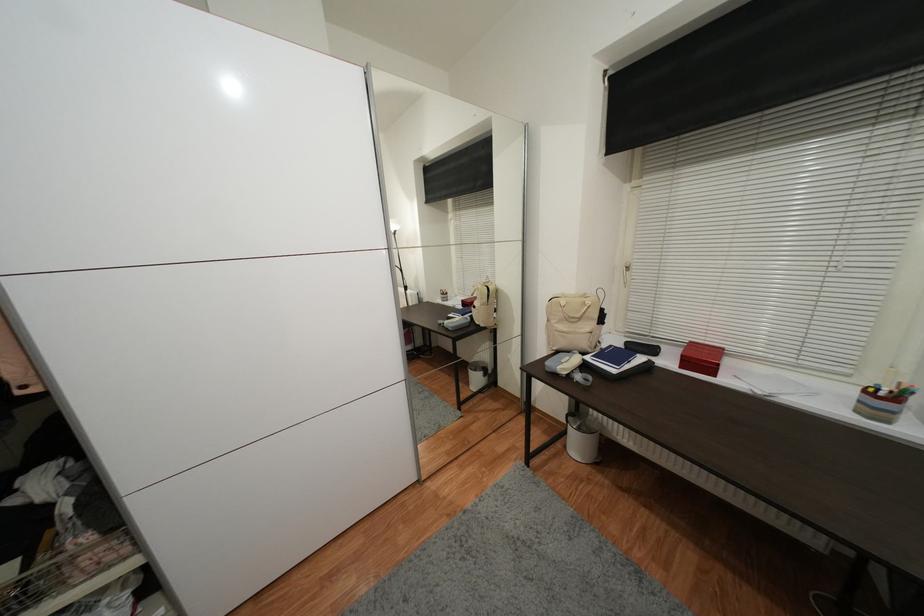
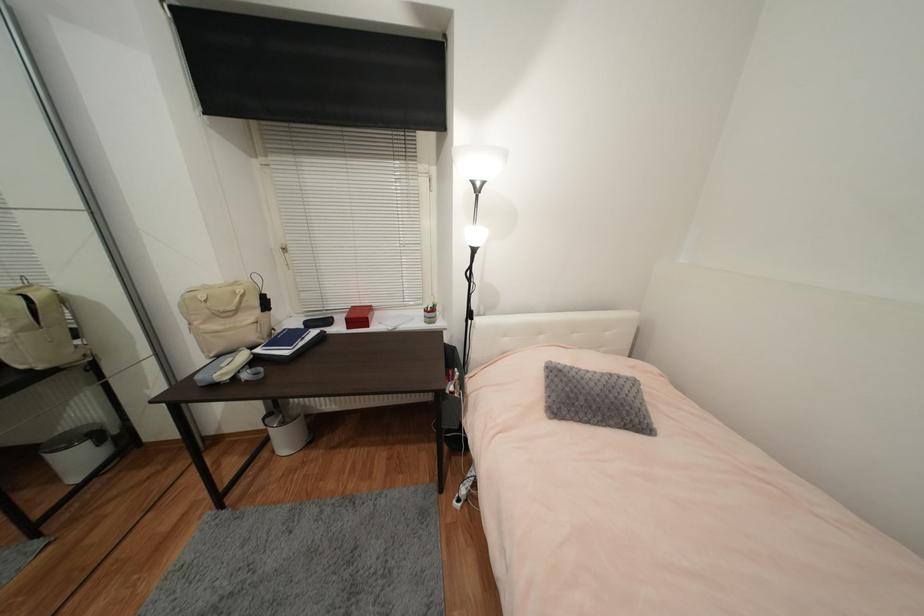
Where in the second image is the point corresponding to point 706,361 from the first image?

(363, 318)